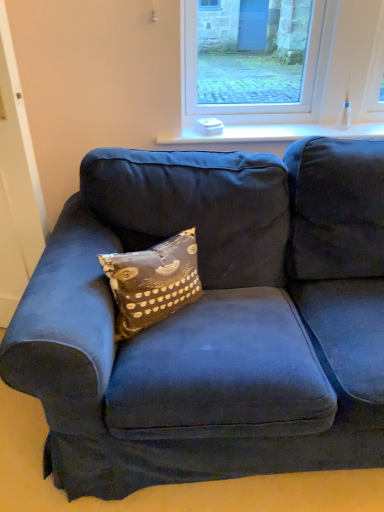
Identify the location of free location above white glossy window sill at upper center (from a real-world perspective). (298, 128).